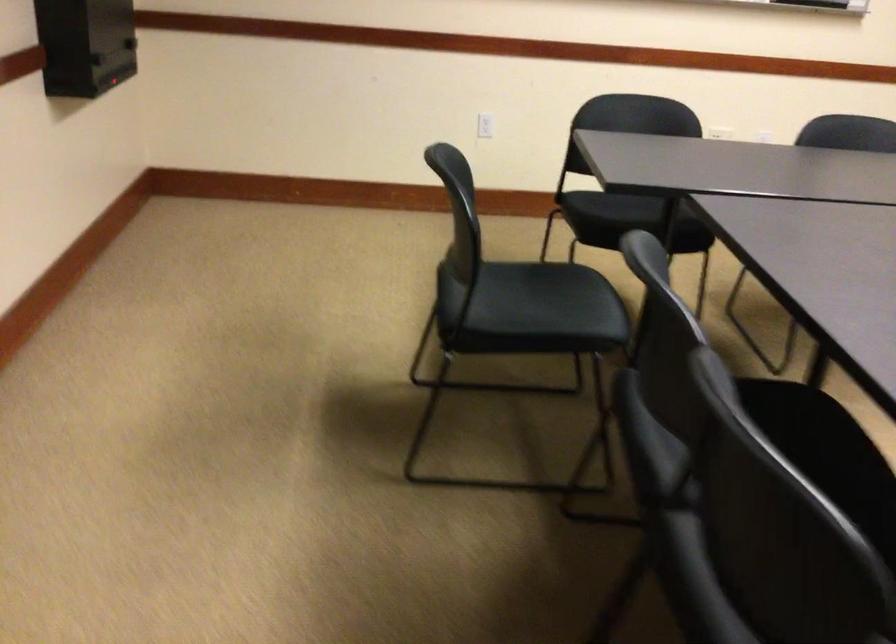
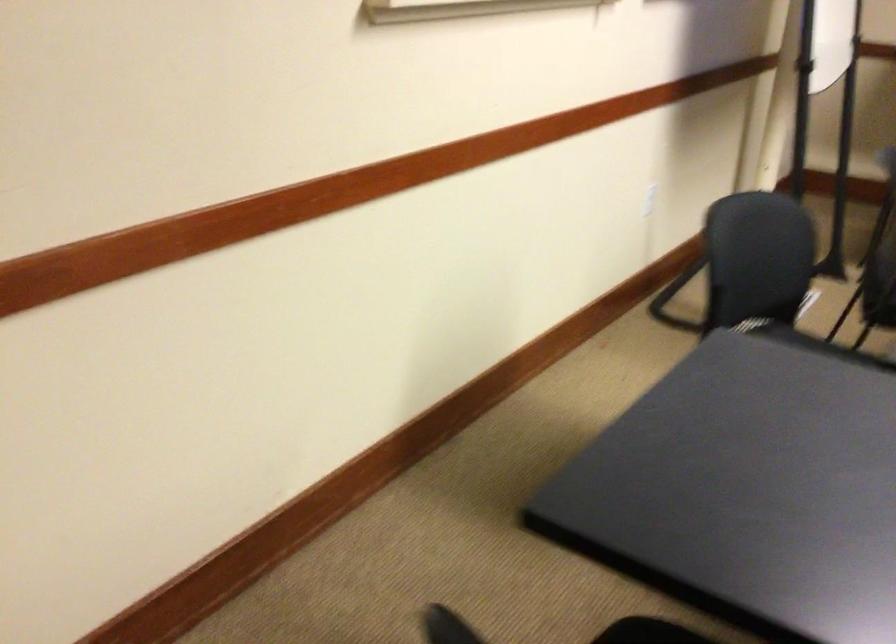
Question: The images are taken continuously from a first-person perspective. In which direction are you moving?

Choices:
 (A) Left
 (B) Right
 (C) Forward
 (D) Backward

Answer: (D)